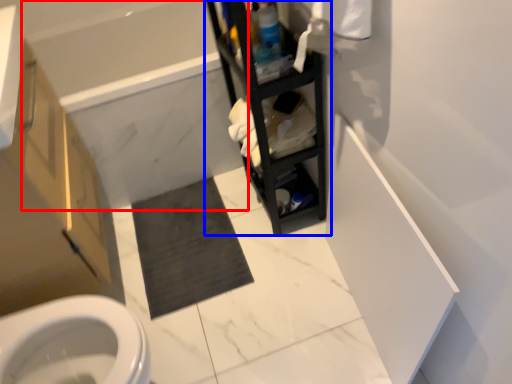
Question: Which point is further to the camera, bath (highlighted by a red box) or shelf (highlighted by a blue box)?

Choices:
 (A) bath
 (B) shelf

Answer: (A)